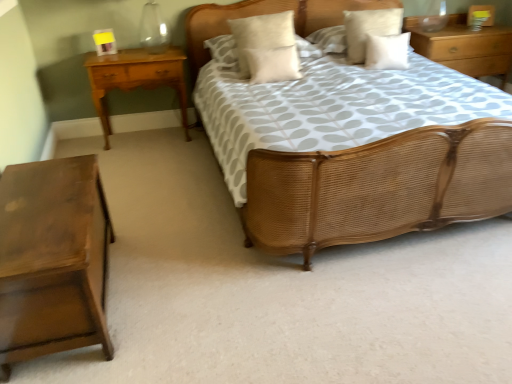
At what (x,y) coordinates should I click in order to perform the action: click on vacant space that's between woven wood bed at center and light brown wood nightstand at left, placed as the third nightstand when sorted from right to left. Please return your answer as a coordinate pair (x, y). The width and height of the screenshot is (512, 384). Looking at the image, I should click on (194, 190).